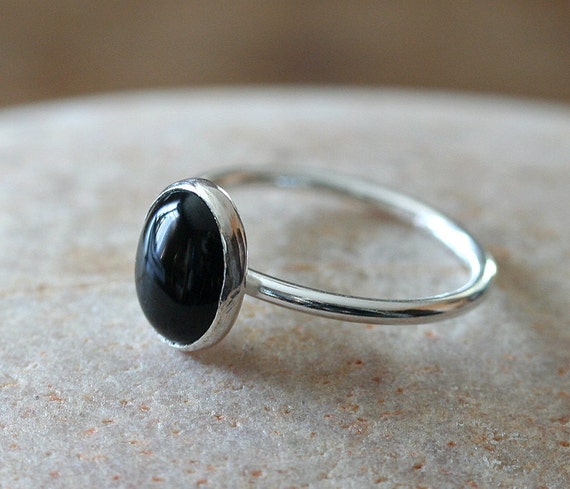
What are the coordinates of `reflection of furniture in ring` in the screenshot? It's located at (161, 273), (197, 283).